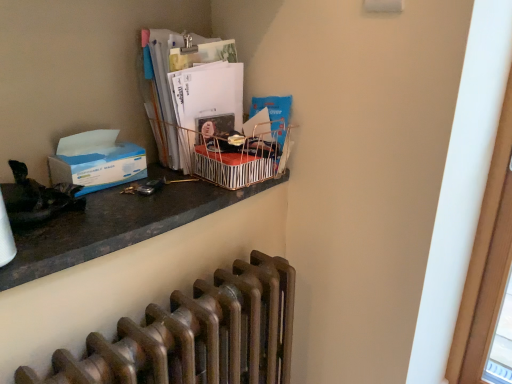
Find the location of a particular element. The height and width of the screenshot is (384, 512). free area in between blue paper at left and matte paper magazine at upper center is located at coordinates (145, 179).